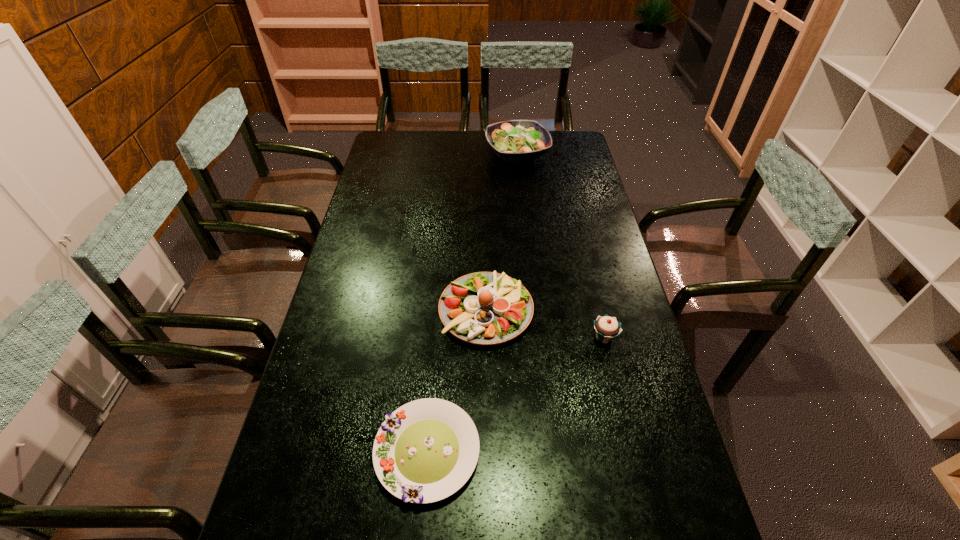
At what (x,y) coordinates should I click in order to perform the action: click on the farthest object. Please return your answer as a coordinate pair (x, y). The image size is (960, 540). Looking at the image, I should click on (515, 140).

You are a GUI agent. You are given a task and a screenshot of the screen. Output one action in this format:
    pyautogui.click(x=<x>, y=<y>)
    Task: Click on the tallest object
    
    Given the screenshot: What is the action you would take?
    pyautogui.click(x=515, y=140)

Locate an element on the screen. Image resolution: width=960 pixels, height=540 pixels. the second tallest salad plate is located at coordinates (484, 308).

At what (x,y) coordinates should I click in order to perform the action: click on cupcake. Please return your answer as a coordinate pair (x, y). Looking at the image, I should click on (607, 328).

The width and height of the screenshot is (960, 540). Find the location of `the shortest salad plate`. the shortest salad plate is located at coordinates (426, 450).

Where is `the shortest object`? The width and height of the screenshot is (960, 540). the shortest object is located at coordinates coord(426,450).

What are the coordinates of `vacant region located 0.050m on the right of the tallest salad plate` in the screenshot? It's located at (561, 153).

Locate an element on the screen. vacant point located 0.190m on the front of the second shortest salad plate is located at coordinates (487, 414).

Locate an element on the screen. This screenshot has height=540, width=960. vacant position located 0.340m on the left of the cupcake is located at coordinates (471, 337).

Where is `vacant area located 0.350m on the back of the nearest salad plate`? vacant area located 0.350m on the back of the nearest salad plate is located at coordinates (440, 299).